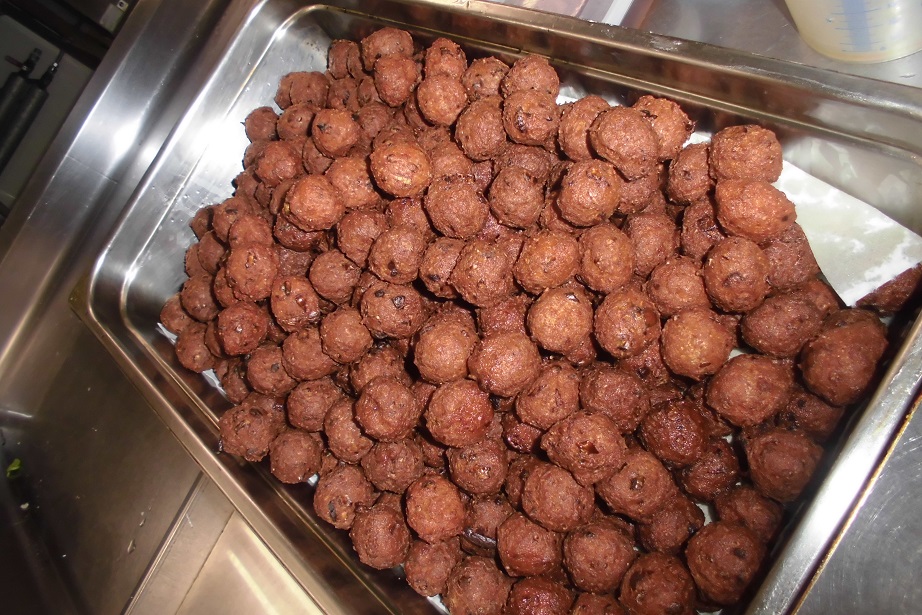
Locate an element on the screen. Image resolution: width=922 pixels, height=615 pixels. sink is located at coordinates (117, 448).